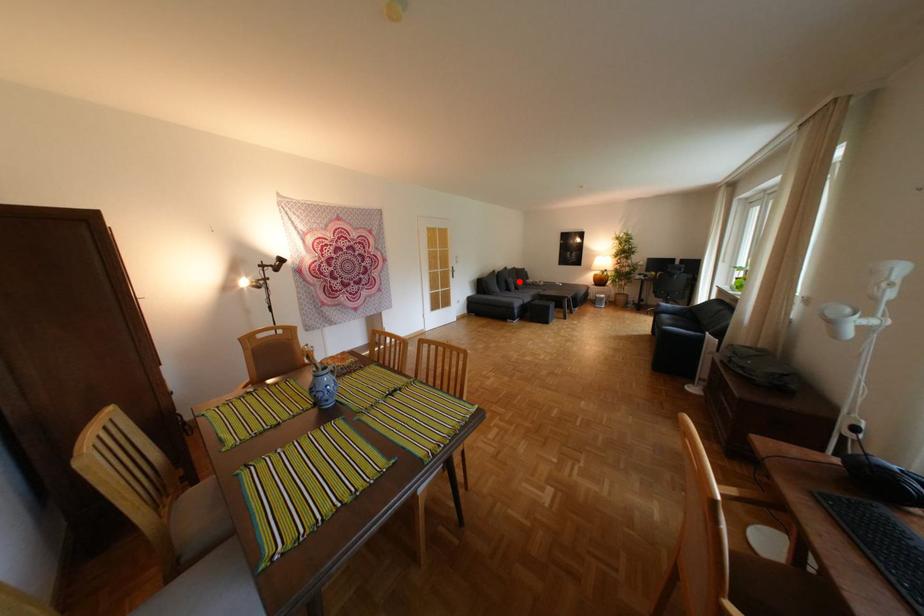
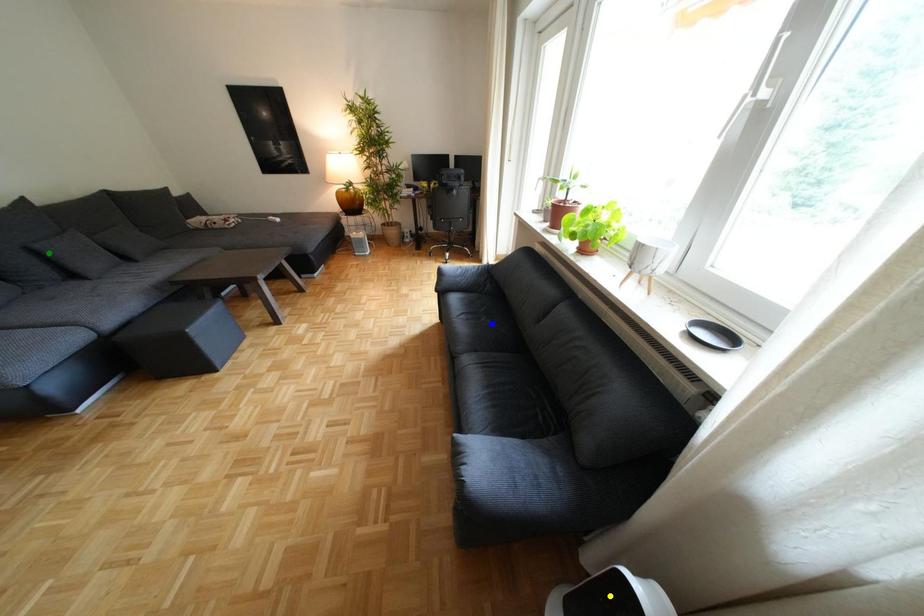
Question: I am providing you with two images of the same scene from different viewpoints. A red point is marked on the first image. You are given multiple points on the second image. Can you choose the point in image 2 that corresponds to the point in image 1?

Choices:
 (A) yellow point
 (B) blue point
 (C) green point

Answer: (C)